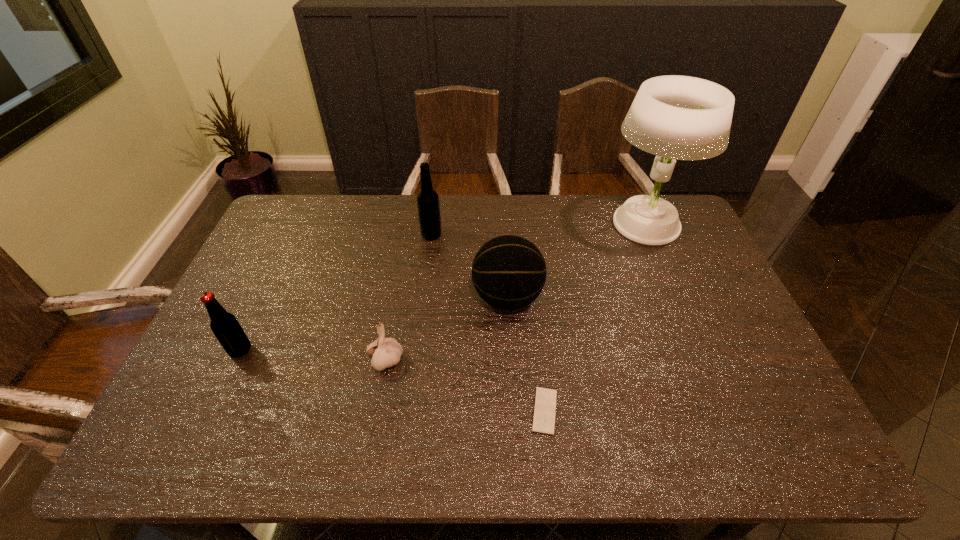
In order to click on vacant space located 0.200m on the front-facing side of the lamp in this screenshot , I will do `click(544, 224)`.

The width and height of the screenshot is (960, 540). Find the location of `vacant space located 0.140m on the front-facing side of the lamp`. vacant space located 0.140m on the front-facing side of the lamp is located at coordinates (562, 224).

Find the location of a particular element. This screenshot has height=540, width=960. vacant space located on the front-facing side of the lamp is located at coordinates (570, 224).

Where is `free point located on the front of the right beer bottle`? free point located on the front of the right beer bottle is located at coordinates (426, 275).

This screenshot has height=540, width=960. Identify the location of vacant space located on the right of the left beer bottle. (323, 351).

This screenshot has height=540, width=960. Find the location of `vacant area situated on the left of the third farthest object`. vacant area situated on the left of the third farthest object is located at coordinates tap(342, 298).

The height and width of the screenshot is (540, 960). What are the coordinates of `free region located 0.050m on the right of the second shortest object` in the screenshot? It's located at (422, 361).

The image size is (960, 540). I want to click on vacant space situated on the right of the nearest object, so click(660, 410).

Locate an element on the screen. The image size is (960, 540). lamp situated at the far edge is located at coordinates (674, 117).

Locate an element on the screen. beer bottle present at the far edge is located at coordinates (428, 205).